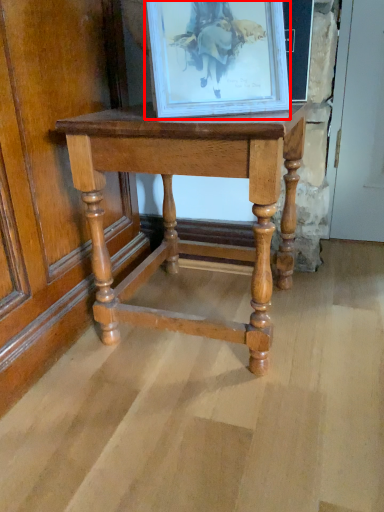
Question: From the image's perspective, what is the correct spatial positioning of picture frame (annotated by the red box) in reference to table?

Choices:
 (A) below
 (B) above

Answer: (B)